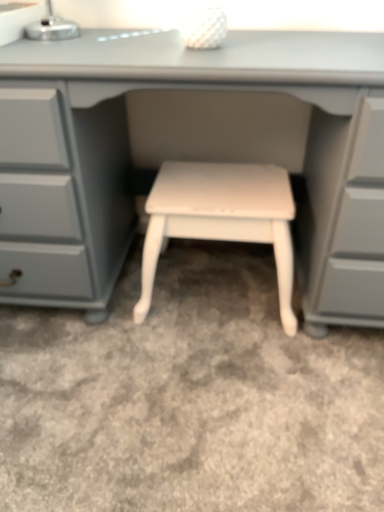
Image resolution: width=384 pixels, height=512 pixels. What are the coordinates of `free space that is to the left of white painted wood stool at center` in the screenshot? It's located at (x=79, y=331).